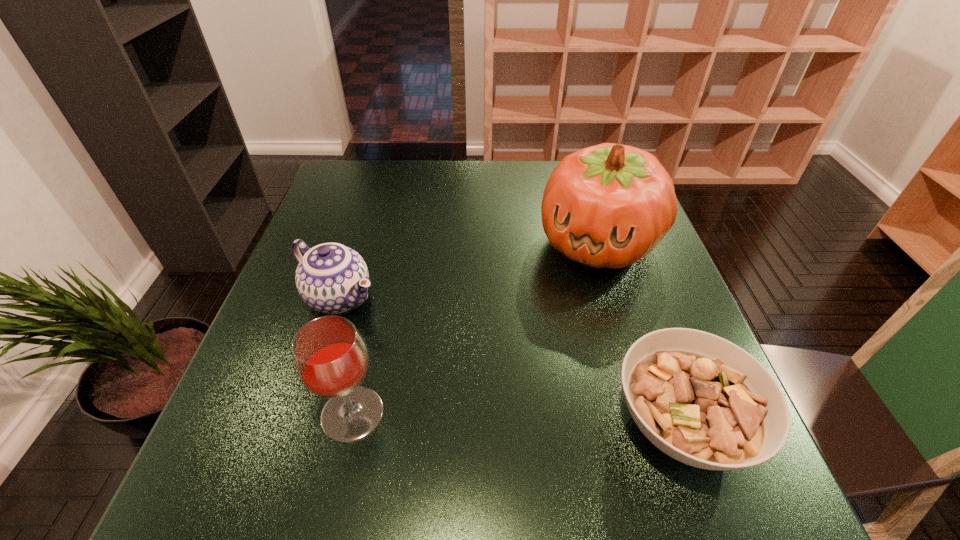
Locate an element on the screen. This screenshot has width=960, height=540. the third shortest object is located at coordinates (330, 358).

Locate an element on the screen. The height and width of the screenshot is (540, 960). the shortest object is located at coordinates (702, 400).

I want to click on the third tallest object, so click(331, 278).

The width and height of the screenshot is (960, 540). I want to click on the tallest object, so click(609, 205).

In order to click on vacant space located on the back of the wineglass in this screenshot , I will do `click(368, 348)`.

This screenshot has width=960, height=540. I want to click on free space located 0.360m on the back of the stew, so click(x=619, y=247).

Locate an element on the screen. This screenshot has height=540, width=960. vacant space situated 0.150m at the spout of the chinaware is located at coordinates (423, 346).

Identify the location of blank space located at the spout of the chinaware. (438, 355).

Identify the location of vacant position located at the spout of the chinaware. (458, 368).

Identify the location of vacant space located 0.210m on the side of the pumpkin with the cute face. The width and height of the screenshot is (960, 540). click(x=543, y=345).